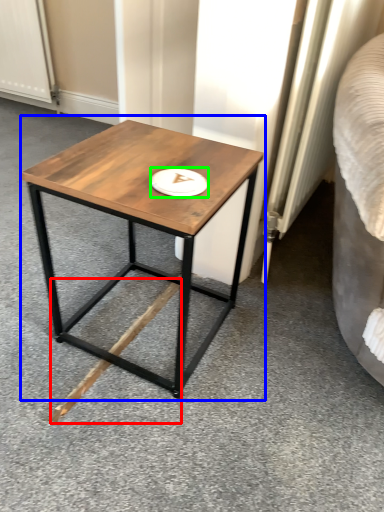
Question: Which object is positioned closest to wood (highlighted by a red box)? Select from coffee table (highlighted by a blue box) and platter (highlighted by a green box).

Choices:
 (A) coffee table
 (B) platter

Answer: (A)